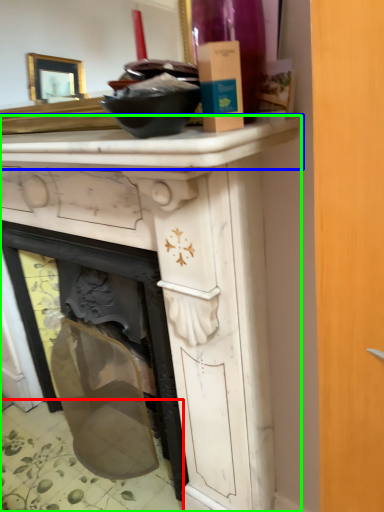
Question: Based on their relative distances, which object is farther from tile (highlighted by a red box)? Choose from counter top (highlighted by a blue box) and vanity (highlighted by a green box).

Choices:
 (A) counter top
 (B) vanity

Answer: (A)